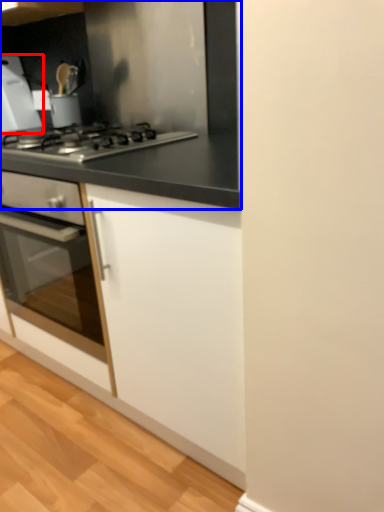
Question: Which object is closer to the camera taking this photo, home appliance (highlighted by a red box) or countertop (highlighted by a blue box)?

Choices:
 (A) home appliance
 (B) countertop

Answer: (B)